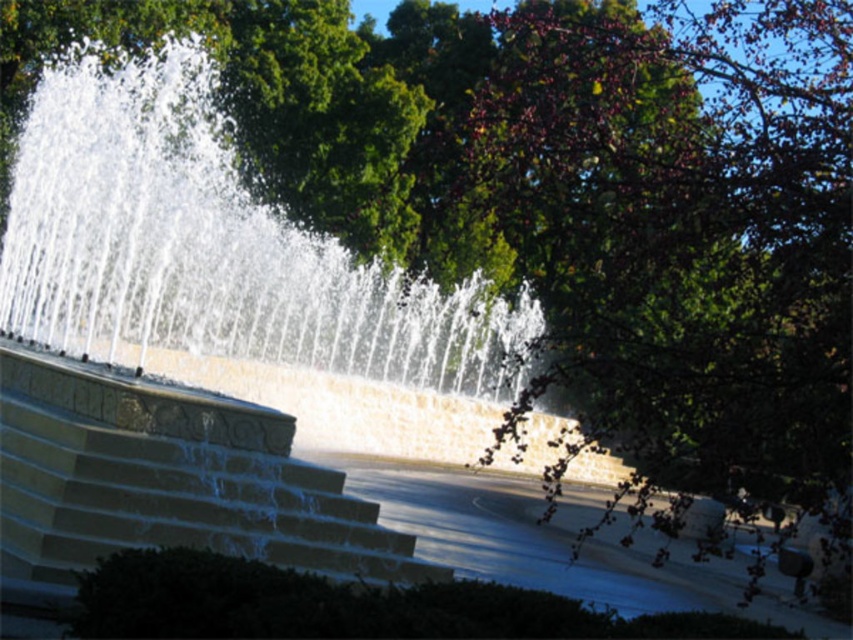
Question: Among these objects, which one is nearest to the camera?

Choices:
 (A) stone stairs at center
 (B) clear water at center

Answer: (A)

Question: In this image, where is clear water at center located relative to stone stairs at center?

Choices:
 (A) above
 (B) below

Answer: (A)

Question: Which of the following is the farthest from the observer?

Choices:
 (A) (125, 524)
 (B) (155, 291)

Answer: (B)

Question: Among these points, which one is nearest to the camera?

Choices:
 (A) (24, 419)
 (B) (41, 92)

Answer: (A)

Question: Does clear water at center have a larger size compared to stone stairs at center?

Choices:
 (A) yes
 (B) no

Answer: (A)

Question: Can you confirm if clear water at center is thinner than stone stairs at center?

Choices:
 (A) yes
 (B) no

Answer: (B)